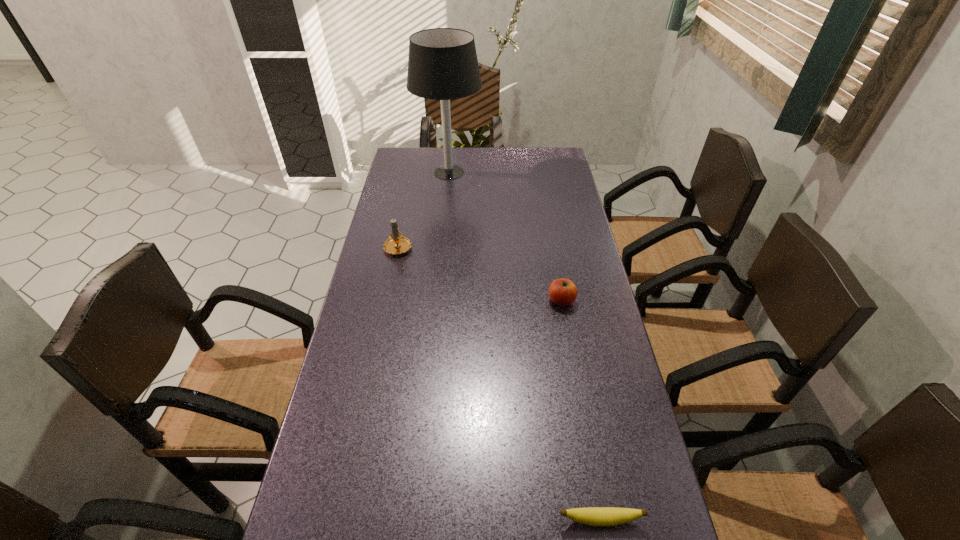
This screenshot has height=540, width=960. Find the location of `vacant region located 0.310m on the back of the third tallest object`. vacant region located 0.310m on the back of the third tallest object is located at coordinates (548, 228).

In order to click on free space located on the left of the shortest object in this screenshot , I will do `click(527, 520)`.

At what (x,y) coordinates should I click in order to perform the action: click on object at the far edge. Please return your answer as a coordinate pair (x, y). Image resolution: width=960 pixels, height=540 pixels. Looking at the image, I should click on (442, 64).

Locate an element on the screen. table lamp at the left edge is located at coordinates (442, 64).

You are a GUI agent. You are given a task and a screenshot of the screen. Output one action in this format:
    pyautogui.click(x=<x>, y=<y>)
    Task: Click on the candle situated at the left edge
    
    Given the screenshot: What is the action you would take?
    pyautogui.click(x=397, y=244)

Identify the location of apple at the right edge. The image size is (960, 540). (563, 292).

Where is `banana situated at the right edge`? banana situated at the right edge is located at coordinates (594, 516).

This screenshot has height=540, width=960. I want to click on object at the far left corner, so click(x=442, y=64).

What are the coordinates of `vacant space at the far edge of the desktop` in the screenshot? It's located at (522, 155).

Where is `free space at the left edge`? Image resolution: width=960 pixels, height=540 pixels. free space at the left edge is located at coordinates (375, 314).